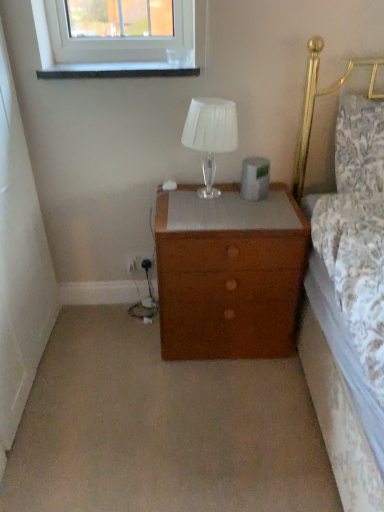
Locate an element on the screen. This screenshot has height=512, width=384. floral fabric pillow at right is located at coordinates (359, 145).

Image resolution: width=384 pixels, height=512 pixels. What are the coordinates of `floral fabric pillow at right` in the screenshot? It's located at (359, 145).

From the image's perspective, is translucent glass table lamp at upper center on wooden nightstand at center?

Correct, translucent glass table lamp at upper center appears higher than wooden nightstand at center in the image.

Is translucent glass table lamp at upper center far away from wooden nightstand at center?

translucent glass table lamp at upper center is near wooden nightstand at center, not far away.

What are the coordinates of `table lamp that appears above the wooden nightstand at center (from a real-world perspective)` in the screenshot? It's located at [210, 135].

Considering the relative sizes of floral fabric pillow at right and translucent glass table lamp at upper center in the image provided, is floral fabric pillow at right bigger than translucent glass table lamp at upper center?

Yes, floral fabric pillow at right is bigger than translucent glass table lamp at upper center.

Is floral fabric pillow at right positioned beyond the bounds of translucent glass table lamp at upper center?

Yes, floral fabric pillow at right is outside of translucent glass table lamp at upper center.

Does floral fabric pillow at right have a lesser height compared to translucent glass table lamp at upper center?

No, floral fabric pillow at right is not shorter than translucent glass table lamp at upper center.

Considering the positions of objects floral fabric pillow at right and granite-like stone window sill at upper left in the image provided, who is more to the right, floral fabric pillow at right or granite-like stone window sill at upper left?

Positioned to the right is floral fabric pillow at right.

From the image's perspective, is floral fabric pillow at right under granite-like stone window sill at upper left?

Correct, floral fabric pillow at right appears lower than granite-like stone window sill at upper left in the image.

Between floral fabric pillow at right and granite-like stone window sill at upper left, which one has larger size?

Bigger between the two is floral fabric pillow at right.

Is wooden nightstand at center not inside floral fabric pillow at right?

wooden nightstand at center is positioned outside floral fabric pillow at right.

Considering the relative positions of wooden nightstand at center and floral fabric pillow at right in the image provided, is wooden nightstand at center to the left of floral fabric pillow at right from the viewer's perspective?

Indeed, wooden nightstand at center is positioned on the left side of floral fabric pillow at right.

Which is nearer, [240,335] or [373,134]?

Point [240,335].

Is wooden nightstand at center far away from floral fabric pillow at right?

That's not correct — wooden nightstand at center is a little close to floral fabric pillow at right.

In the scene shown: Which of these two, granite-like stone window sill at upper left or floral fabric pillow at right, is bigger?

Bigger between the two is floral fabric pillow at right.

Considering the points (57, 74) and (377, 170), which point is in front, point (57, 74) or point (377, 170)?

Positioned in front is point (377, 170).

At what (x,y) coordinates should I click in order to perform the action: click on window sill behind the floral fabric pillow at right. Please return your answer as a coordinate pair (x, y). Looking at the image, I should click on (117, 70).

Are granite-like stone window sill at upper left and floral fabric pillow at right located far from each other?

They are positioned close to each other.

Is floral fabric pillow at right inside or outside of wooden nightstand at center?

floral fabric pillow at right cannot be found inside wooden nightstand at center.

From the picture: Is the position of floral fabric pillow at right less distant than that of wooden nightstand at center?

Yes, floral fabric pillow at right is closer to the viewer.

At what (x,y) coordinates should I click in order to perform the action: click on nightstand located behind the floral fabric pillow at right. Please return your answer as a coordinate pair (x, y). The height and width of the screenshot is (512, 384). Looking at the image, I should click on (228, 276).

Identify the location of nightstand on the right side of granite-like stone window sill at upper left. Image resolution: width=384 pixels, height=512 pixels. (228, 276).

Considering the relative positions of granite-like stone window sill at upper left and wooden nightstand at center in the image provided, is granite-like stone window sill at upper left to the left or to the right of wooden nightstand at center?

From the image, it's evident that granite-like stone window sill at upper left is to the left of wooden nightstand at center.

From a real-world perspective, which object stands above the other?

granite-like stone window sill at upper left, from a real-world perspective.

Where is `nightstand on the right of translucent glass table lamp at upper center`? The image size is (384, 512). nightstand on the right of translucent glass table lamp at upper center is located at coordinates (228, 276).

Find the location of `pillow in front of the translucent glass table lamp at upper center`. pillow in front of the translucent glass table lamp at upper center is located at coordinates (359, 145).

From the image, which object appears to be farther from translucent glass table lamp at upper center, floral fabric pillow at right or granite-like stone window sill at upper left?

floral fabric pillow at right is positioned further to the anchor translucent glass table lamp at upper center.

Which object lies further to the anchor point wooden nightstand at center, floral fabric pillow at right or translucent glass table lamp at upper center?

floral fabric pillow at right is positioned further to the anchor wooden nightstand at center.

Looking at the image, which one is located further to wooden nightstand at center, granite-like stone window sill at upper left or translucent glass table lamp at upper center?

granite-like stone window sill at upper left.

From the picture: Estimate the real-world distances between objects in this image. Which object is further from floral fabric pillow at right, translucent glass table lamp at upper center or granite-like stone window sill at upper left?

Based on the image, granite-like stone window sill at upper left appears to be further to floral fabric pillow at right.

In the scene shown: When comparing their distances from translucent glass table lamp at upper center, does floral fabric pillow at right or wooden nightstand at center seem closer?

wooden nightstand at center lies closer to translucent glass table lamp at upper center than the other object.

Looking at the image, which one is located closer to granite-like stone window sill at upper left, floral fabric pillow at right or translucent glass table lamp at upper center?

translucent glass table lamp at upper center is positioned closer to the anchor granite-like stone window sill at upper left.

From the image, which object appears to be farther from granite-like stone window sill at upper left, wooden nightstand at center or floral fabric pillow at right?

wooden nightstand at center.

Estimate the real-world distances between objects in this image. Which object is further from granite-like stone window sill at upper left, translucent glass table lamp at upper center or floral fabric pillow at right?

Based on the image, floral fabric pillow at right appears to be further to granite-like stone window sill at upper left.

Locate an element on the screen. table lamp between granite-like stone window sill at upper left and floral fabric pillow at right is located at coordinates (210, 135).

Where is `nightstand situated between translucent glass table lamp at upper center and floral fabric pillow at right from left to right`? The height and width of the screenshot is (512, 384). nightstand situated between translucent glass table lamp at upper center and floral fabric pillow at right from left to right is located at coordinates (228, 276).

Identify the location of table lamp that lies between granite-like stone window sill at upper left and wooden nightstand at center from top to bottom. The height and width of the screenshot is (512, 384). (210, 135).

Identify the location of nightstand between granite-like stone window sill at upper left and floral fabric pillow at right from left to right. (228, 276).